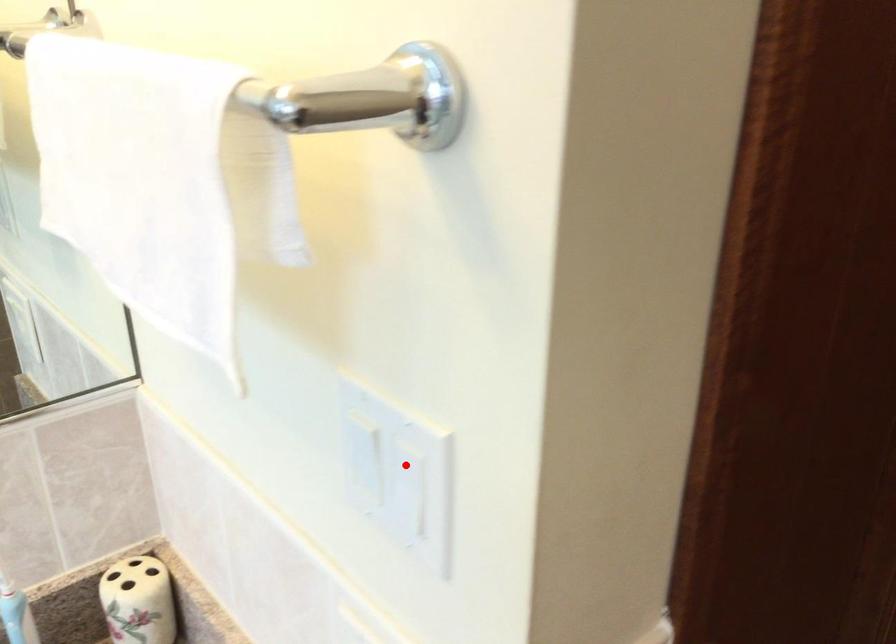
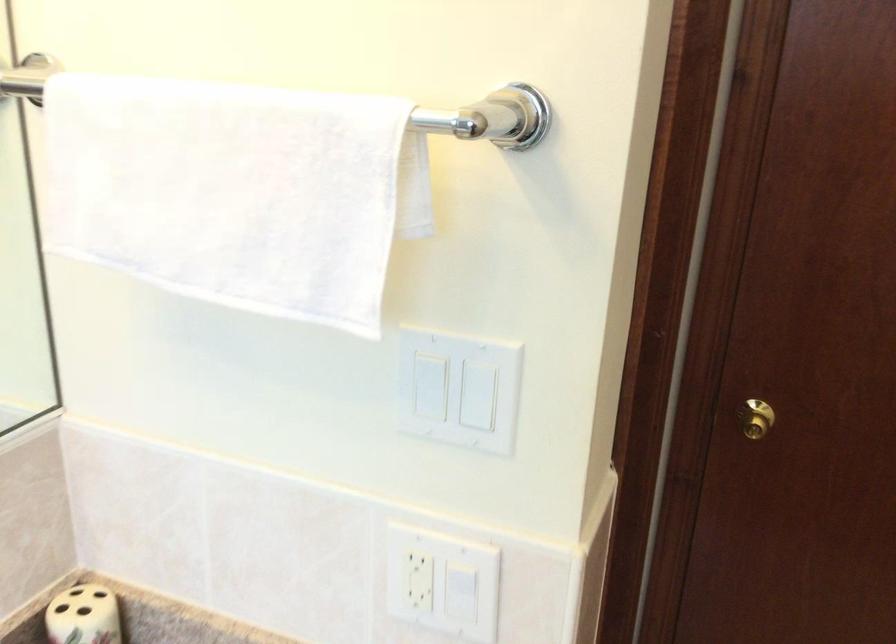
Where in the second image is the point corresponding to the highlighted location from the first image?

(458, 389)